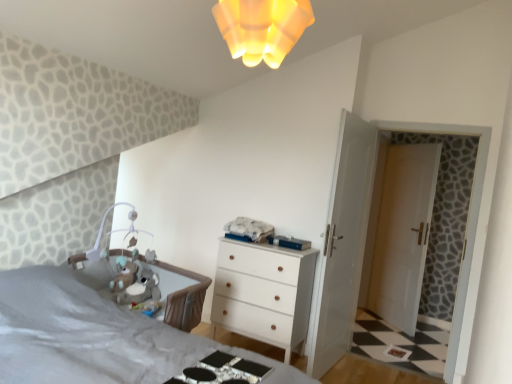
Question: Considering the relative positions of metallic silver changing table at lower center and white matte chest of drawers at center in the image provided, is metallic silver changing table at lower center in front of white matte chest of drawers at center?

Choices:
 (A) no
 (B) yes

Answer: (B)

Question: Is white matte chest of drawers at center surrounded by metallic silver changing table at lower center?

Choices:
 (A) no
 (B) yes

Answer: (A)

Question: Does metallic silver changing table at lower center have a smaller size compared to white matte chest of drawers at center?

Choices:
 (A) no
 (B) yes

Answer: (B)

Question: Considering the relative positions of metallic silver changing table at lower center and white matte chest of drawers at center in the image provided, is metallic silver changing table at lower center to the left of white matte chest of drawers at center from the viewer's perspective?

Choices:
 (A) yes
 (B) no

Answer: (A)

Question: Does metallic silver changing table at lower center touch white matte chest of drawers at center?

Choices:
 (A) yes
 (B) no

Answer: (B)

Question: Relative to soft plush toy at center, is yellow frosted glass light fixture at upper center in front or behind?

Choices:
 (A) behind
 (B) front

Answer: (B)

Question: In terms of size, does yellow frosted glass light fixture at upper center appear bigger or smaller than soft plush toy at center?

Choices:
 (A) big
 (B) small

Answer: (A)

Question: Considering the relative positions of yellow frosted glass light fixture at upper center and soft plush toy at center in the image provided, is yellow frosted glass light fixture at upper center to the left or to the right of soft plush toy at center?

Choices:
 (A) right
 (B) left

Answer: (A)

Question: Is point (281, 51) positioned closer to the camera than point (143, 289)?

Choices:
 (A) closer
 (B) farther

Answer: (A)

Question: Is white glossy door at right in front of or behind white glossy door at right, acting as the first door starting from the right, in the image?

Choices:
 (A) front
 (B) behind

Answer: (A)

Question: In terms of width, does white glossy door at right look wider or thinner when compared to white glossy door at right, placed as the 2th door when sorted from left to right?

Choices:
 (A) thin
 (B) wide

Answer: (B)

Question: From a real-world perspective, is white glossy door at right above or below white glossy door at right, placed as the 2th door when sorted from left to right?

Choices:
 (A) above
 (B) below

Answer: (A)

Question: Is white glossy door at right taller or shorter than white glossy door at right, placed as the 2th door when sorted from left to right?

Choices:
 (A) short
 (B) tall

Answer: (B)

Question: Looking at their shapes, would you say white glossy door at right is wider or thinner than soft plush toy at center?

Choices:
 (A) thin
 (B) wide

Answer: (A)

Question: Relative to soft plush toy at center, is white glossy door at right in front or behind?

Choices:
 (A) front
 (B) behind

Answer: (B)